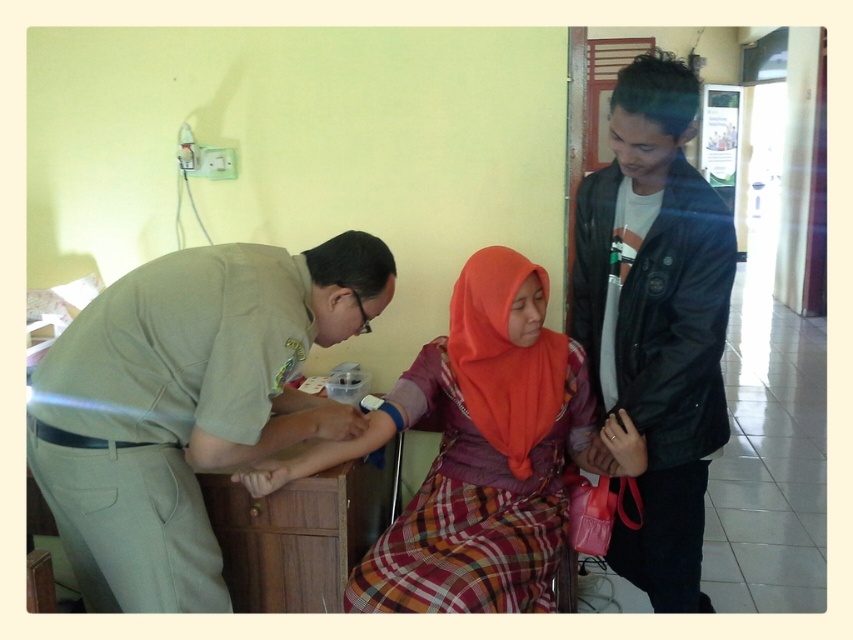
Question: Estimate the real-world distances between objects in this image. Which object is farther from the black leather jacket at right?

Choices:
 (A) wooden drawer at lower left
 (B) matte orange hijab at center

Answer: (A)

Question: Among these objects, which one is nearest to the camera?

Choices:
 (A) black leather jacket at right
 (B) matte orange hijab at center

Answer: (B)

Question: Does khaki uniform at center have a greater width compared to black leather jacket at right?

Choices:
 (A) no
 (B) yes

Answer: (B)

Question: Which of the following is the farthest from the observer?

Choices:
 (A) matte orange hijab at center
 (B) wooden drawer at lower left

Answer: (B)

Question: Is khaki uniform at center below wooden drawer at lower left?

Choices:
 (A) yes
 (B) no

Answer: (B)

Question: From the image, what is the correct spatial relationship of matte orange hijab at center in relation to wooden drawer at lower left?

Choices:
 (A) above
 (B) below

Answer: (A)